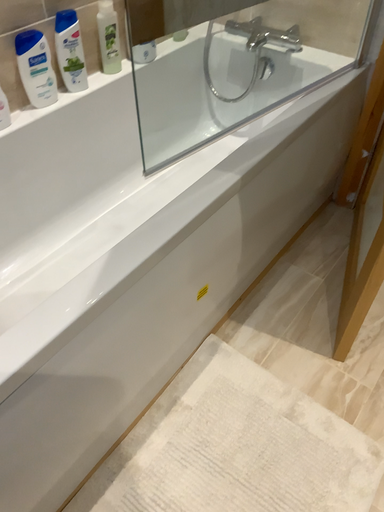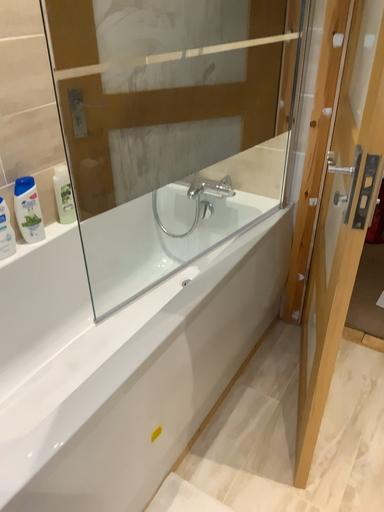
Question: How did the camera likely rotate when shooting the video?

Choices:
 (A) rotated downward
 (B) rotated upward

Answer: (B)